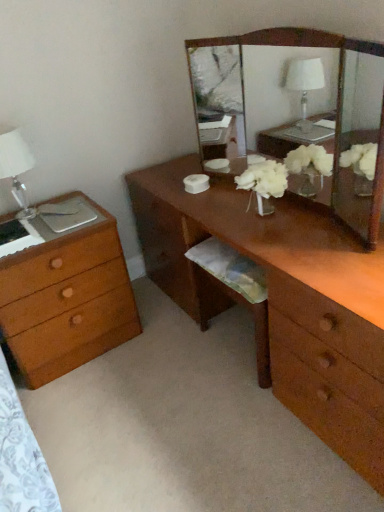
This screenshot has width=384, height=512. I want to click on free space to the right of wooden chest of drawers at left, so click(x=154, y=342).